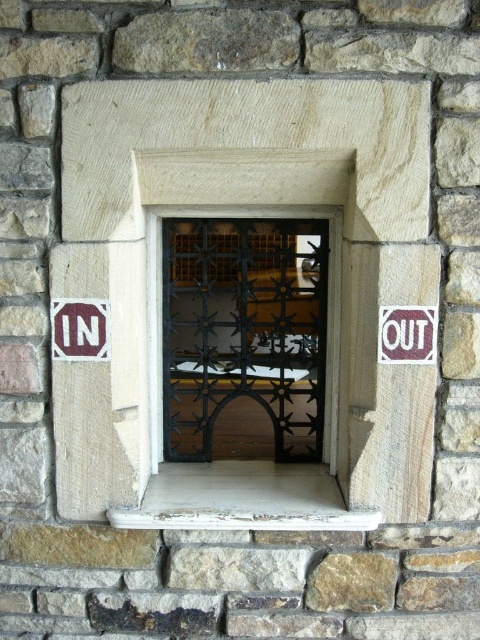
You are standing in front of the window and see both the maroon plastic sign at right and the white plastic sign at left. Which sign is shorter?

The maroon plastic sign at right has a lesser height compared to the white plastic sign at left, so the maroon plastic sign at right is shorter.

You are standing in front of the window with a black metal grille. There is a point marked at coordinates point (432,339). If you want to reach this point with a 1.10 meter long stick, will you be able to do so?

The point (432,339) is 1.20 meters away from the viewer. Since the stick is only 1.10 meters long, it is too short to reach the point.